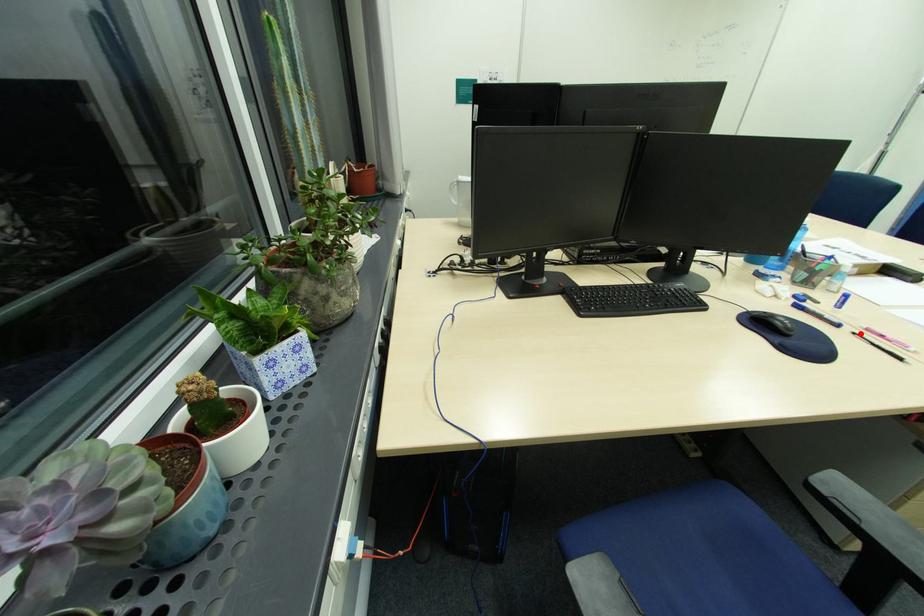
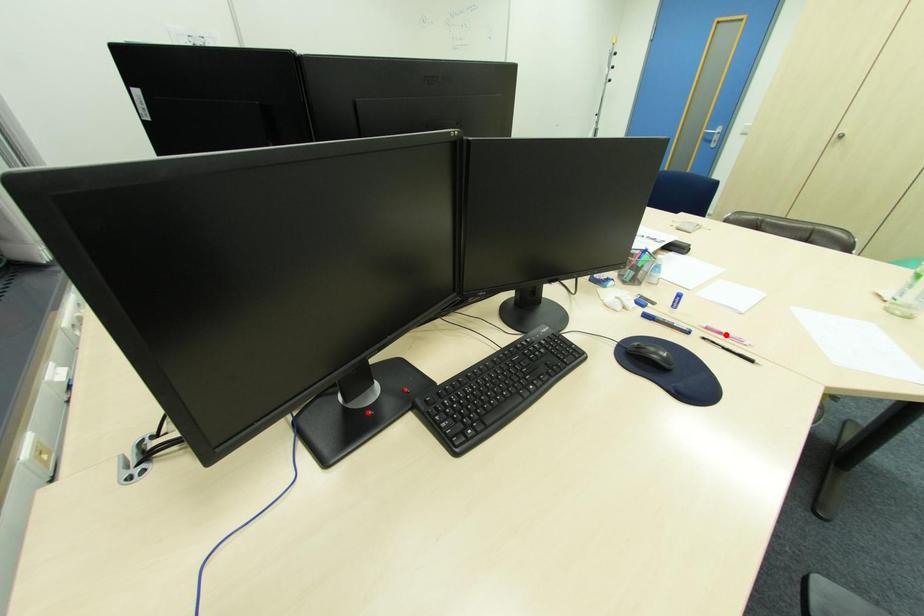
I am providing you with two images of the same scene from different viewpoints. A red point is marked on the first image and another point is marked on the second image. Is the marked point in image1 the same physical position as the marked point in image2?

No